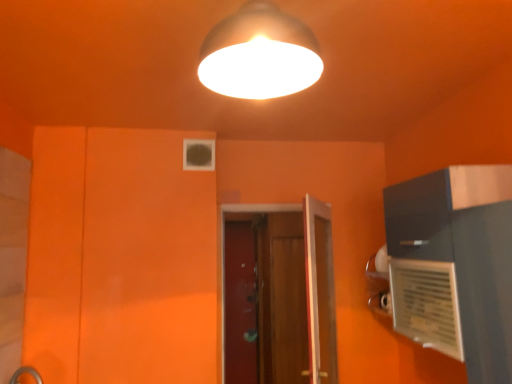
Question: From the image's perspective, would you say wooden door at center is positioned over matte white lampshade at upper center?

Choices:
 (A) no
 (B) yes

Answer: (A)

Question: Does wooden door at center touch matte white lampshade at upper center?

Choices:
 (A) no
 (B) yes

Answer: (A)

Question: Can you confirm if wooden door at center is taller than matte white lampshade at upper center?

Choices:
 (A) no
 (B) yes

Answer: (B)

Question: Would you say wooden door at center is outside matte white lampshade at upper center?

Choices:
 (A) yes
 (B) no

Answer: (A)

Question: Is wooden door at center to the right of matte white lampshade at upper center from the viewer's perspective?

Choices:
 (A) no
 (B) yes

Answer: (B)

Question: Visually, is wooden screen door at center, which is the first screen door in right-to-left order, positioned to the left or to the right of matte white lampshade at upper center?

Choices:
 (A) right
 (B) left

Answer: (A)

Question: Is wooden screen door at center, which is the first screen door in right-to-left order, taller or shorter than matte white lampshade at upper center?

Choices:
 (A) short
 (B) tall

Answer: (B)

Question: Does point (284, 354) appear closer or farther from the camera than point (236, 44)?

Choices:
 (A) closer
 (B) farther

Answer: (B)

Question: Based on their sizes in the image, would you say wooden screen door at center, which appears as the 2th screen door when viewed from the left, is bigger or smaller than matte white lampshade at upper center?

Choices:
 (A) small
 (B) big

Answer: (B)

Question: From the image's perspective, is wooden screen door at center, which appears as the 2th screen door when viewed from the left, located above or below transparent glass screen door at center, which appears as the second screen door when viewed from the right?

Choices:
 (A) above
 (B) below

Answer: (A)

Question: Is wooden screen door at center, which appears as the 2th screen door when viewed from the left, bigger or smaller than transparent glass screen door at center, which appears as the second screen door when viewed from the right?

Choices:
 (A) small
 (B) big

Answer: (B)

Question: Is point (300, 251) closer or farther from the camera than point (245, 269)?

Choices:
 (A) closer
 (B) farther

Answer: (A)

Question: Is wooden screen door at center, which is the first screen door in right-to-left order, in front of or behind transparent glass screen door at center, which appears as the second screen door when viewed from the right, in the image?

Choices:
 (A) front
 (B) behind

Answer: (A)

Question: In terms of height, does wooden screen door at center, which appears as the 2th screen door when viewed from the left, look taller or shorter compared to wooden door at center?

Choices:
 (A) tall
 (B) short

Answer: (A)

Question: Considering their positions, is wooden screen door at center, which appears as the 2th screen door when viewed from the left, located in front of or behind wooden door at center?

Choices:
 (A) behind
 (B) front

Answer: (A)